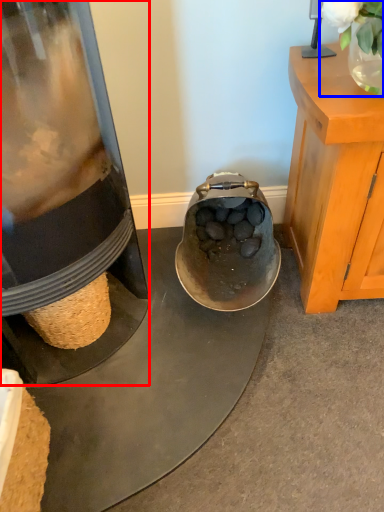
Question: Which object appears farthest to the camera in this image, appliance (highlighted by a red box) or plant (highlighted by a blue box)?

Choices:
 (A) appliance
 (B) plant

Answer: (B)